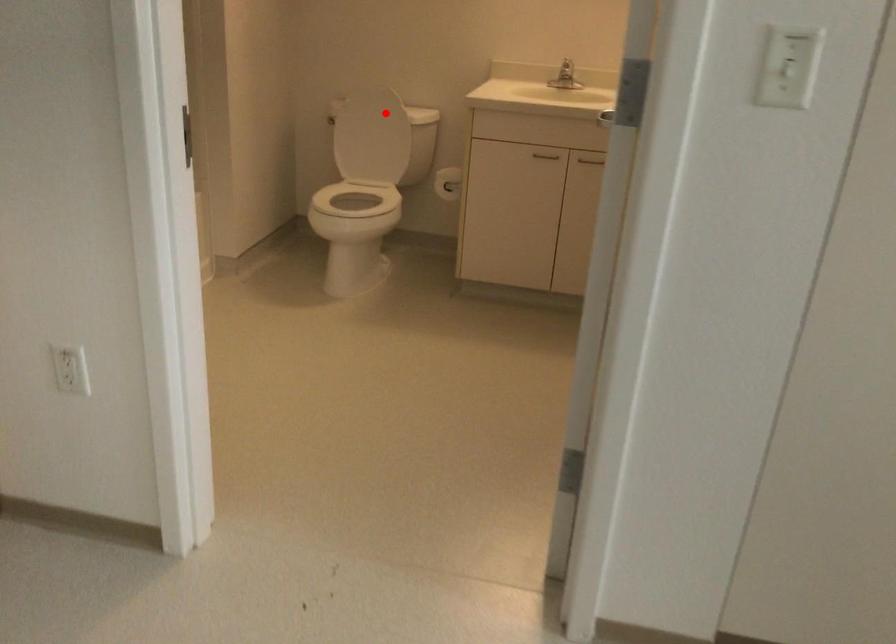
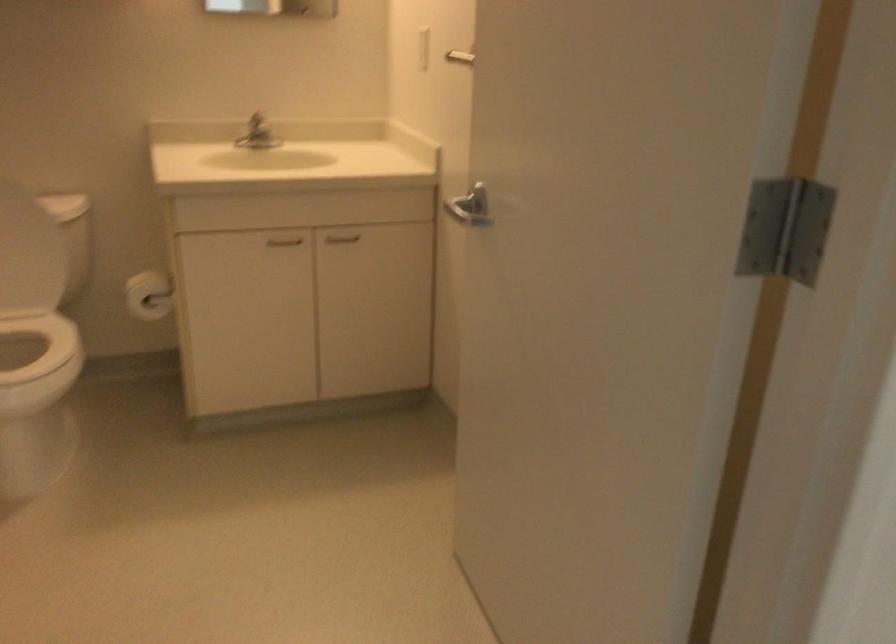
Question: I am providing you with two images of the same scene from different viewpoints. Given a red point in image1, look at the same physical point in image2. Is it:

Choices:
 (A) Closer to the viewpoint
 (B) Farther from the viewpoint

Answer: (A)